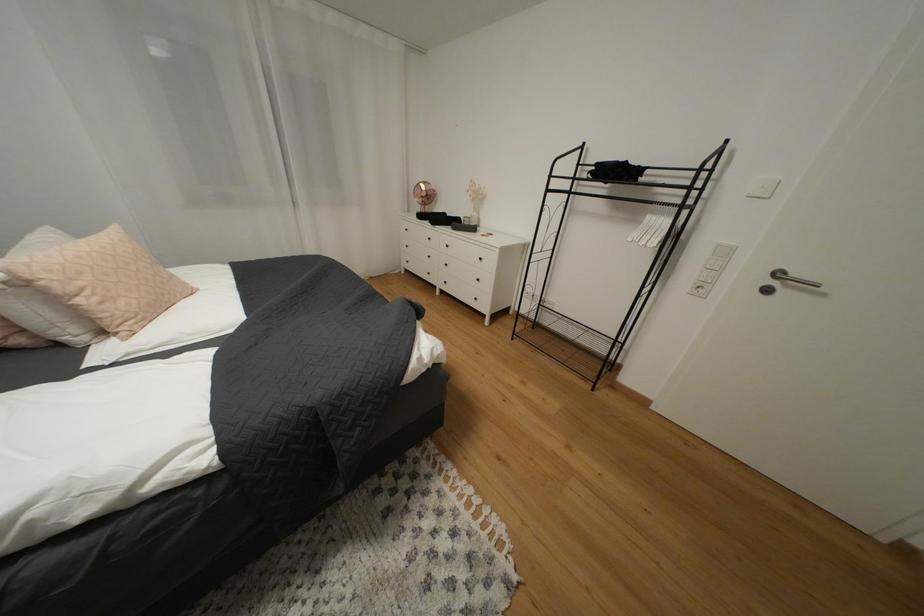
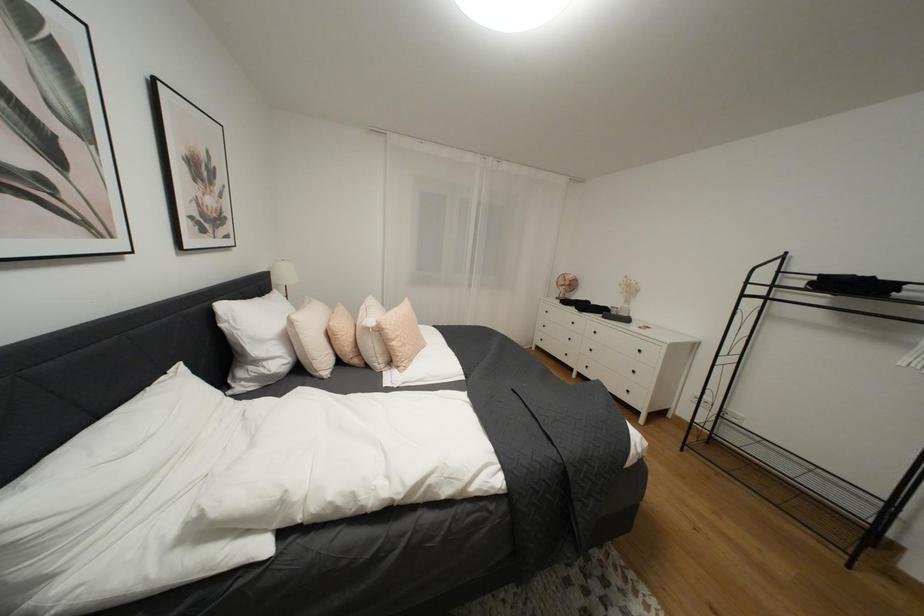
Question: The camera is either moving clockwise (left) or counter-clockwise (right) around the object. The first image is from the beginning of the video and the second image is from the end. Is the camera moving left or right when shooting the video?

Choices:
 (A) Left
 (B) Right

Answer: (B)